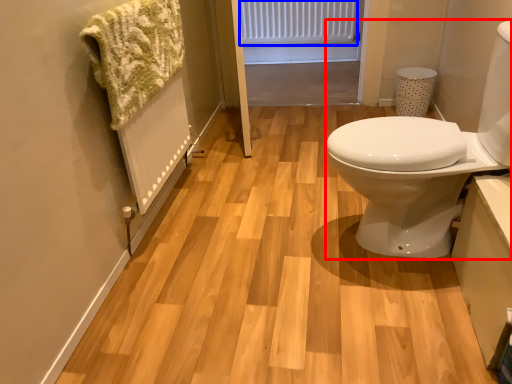
Question: Which object is closer to the camera taking this photo, sink (highlighted by a red box) or radiator (highlighted by a blue box)?

Choices:
 (A) sink
 (B) radiator

Answer: (A)